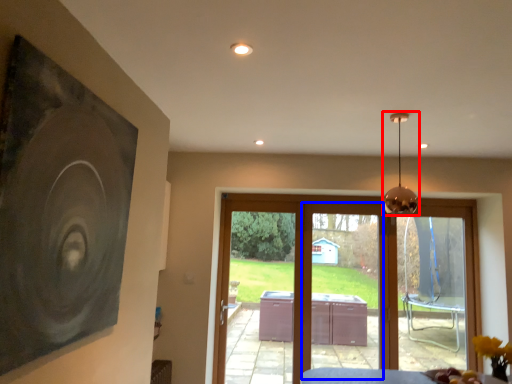
Question: Among these objects, which one is farthest to the camera, lamp (highlighted by a red box) or screen door (highlighted by a blue box)?

Choices:
 (A) lamp
 (B) screen door

Answer: (B)